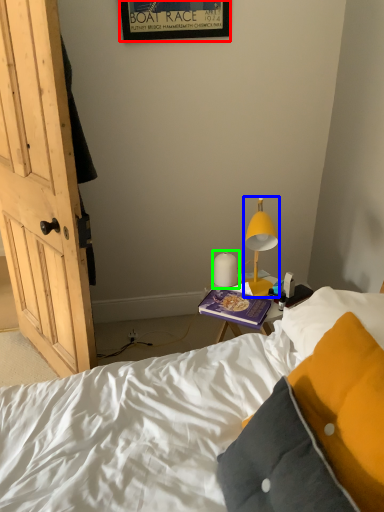
Question: Which is farther away from picture frame (highlighted by a red box)? lamp (highlighted by a blue box) or lamp (highlighted by a green box)?

Choices:
 (A) lamp
 (B) lamp

Answer: (B)